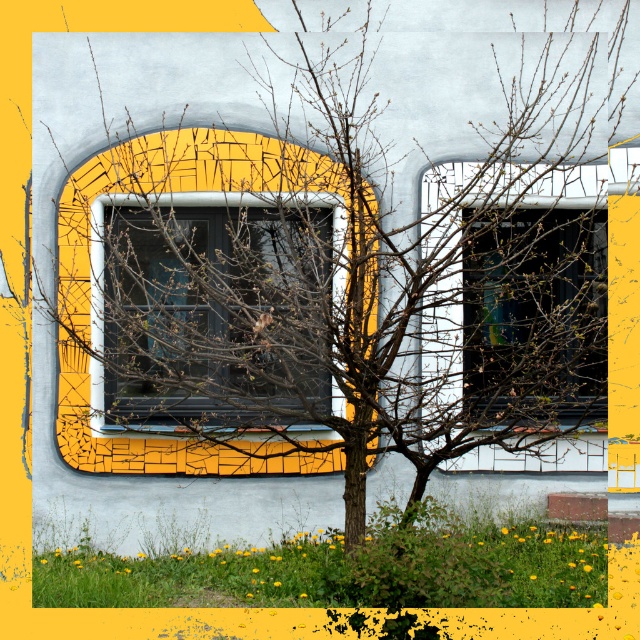
You are a window installer who needs to replace both the matte glass window at center and the transparent glass window at center. The two windows are positioned very close to each other. If your ladder can only reach 5 feet, can you safely reach both windows without moving the ladder?

The matte glass window at center is 4.50 feet away from the transparent glass window at center. Since the distance between them is less than the ladder reach of 5 feet, you can safely reach both windows without moving the ladder.